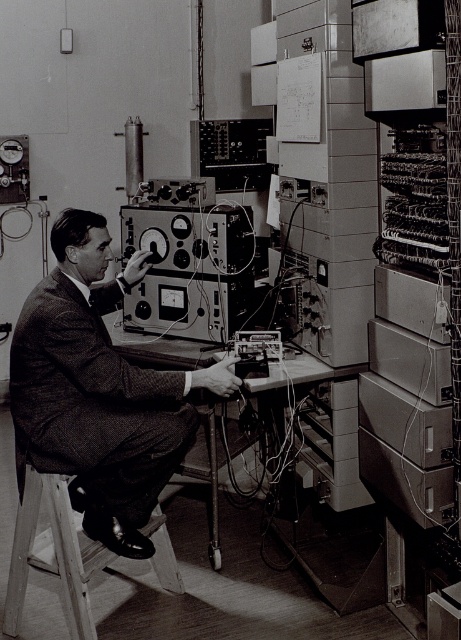
Based on the photo, you are a fashion designer observing the image and need to determine the placement of the textured wool suit at center relative to the wooden stool at lower left. Which object is located to the right of the other?

The textured wool suit at center is positioned on the right side of wooden stool at lower left.

You are a tailor who needs to determine which item is bigger between the textured wool suit at center and the wooden stool at lower left. Which one is larger?

The textured wool suit at center is larger than the wooden stool at lower left according to the description.